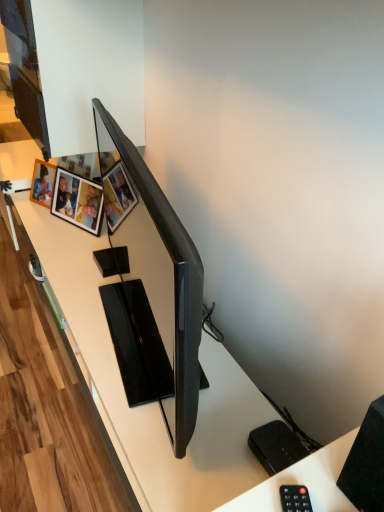
Question: Is wooden photo frame at upper left, acting as the first picture frame starting from the right, situated inside black matte speaker at lower right or outside?

Choices:
 (A) outside
 (B) inside

Answer: (A)

Question: Considering their positions, is wooden photo frame at upper left, the 2th picture frame in the left-to-right sequence, located in front of or behind black matte speaker at lower right?

Choices:
 (A) behind
 (B) front

Answer: (A)

Question: Based on their relative distances, which object is nearer to the black matte speaker at lower right?

Choices:
 (A) black plastic remote at lower right
 (B) wooden photo frame at upper left, the 2th picture frame in the left-to-right sequence
 (C) matte black tv at center
 (D) white plastic remote control at lower right
 (E) wooden photo frame at upper left, which is counted as the first picture frame, starting from the left

Answer: (D)

Question: Considering the real-world distances, which object is closest to the white plastic remote control at lower right?

Choices:
 (A) wooden photo frame at upper left, which is counted as the first picture frame, starting from the left
 (B) black matte speaker at lower right
 (C) wooden photo frame at upper left, the 2th picture frame in the left-to-right sequence
 (D) matte black tv at center
 (E) black plastic remote at lower right

Answer: (E)